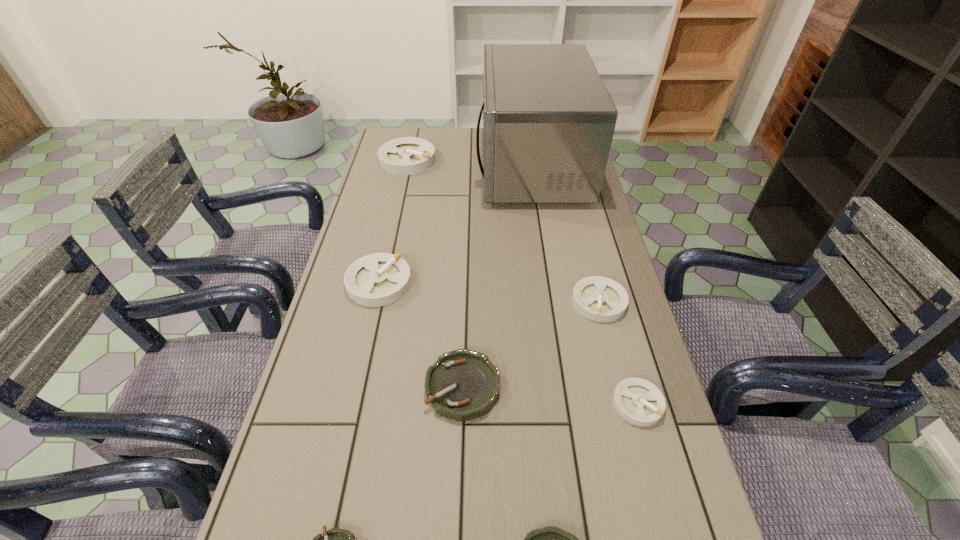
I want to click on green ashtray that is the third closest to the third tallest ashtray, so click(x=336, y=539).

Locate an element on the screen. The width and height of the screenshot is (960, 540). the closest green ashtray to the leftmost green ashtray is located at coordinates (463, 384).

Image resolution: width=960 pixels, height=540 pixels. Find the location of `vacant space that satisfies the following two spatial constraints: 1. on the front-facing side of the third tallest ashtray; 2. on the left side of the microwave oven`. vacant space that satisfies the following two spatial constraints: 1. on the front-facing side of the third tallest ashtray; 2. on the left side of the microwave oven is located at coordinates click(553, 302).

Locate an element on the screen. This screenshot has height=540, width=960. vacant position in the image that satisfies the following two spatial constraints: 1. on the front-facing side of the fourth tallest object; 2. on the left side of the tallest object is located at coordinates (553, 302).

This screenshot has width=960, height=540. In order to click on vacant position in the image that satisfies the following two spatial constraints: 1. on the front side of the third biggest gray ashtray; 2. on the left side of the smallest gray ashtray in this screenshot , I will do [625, 403].